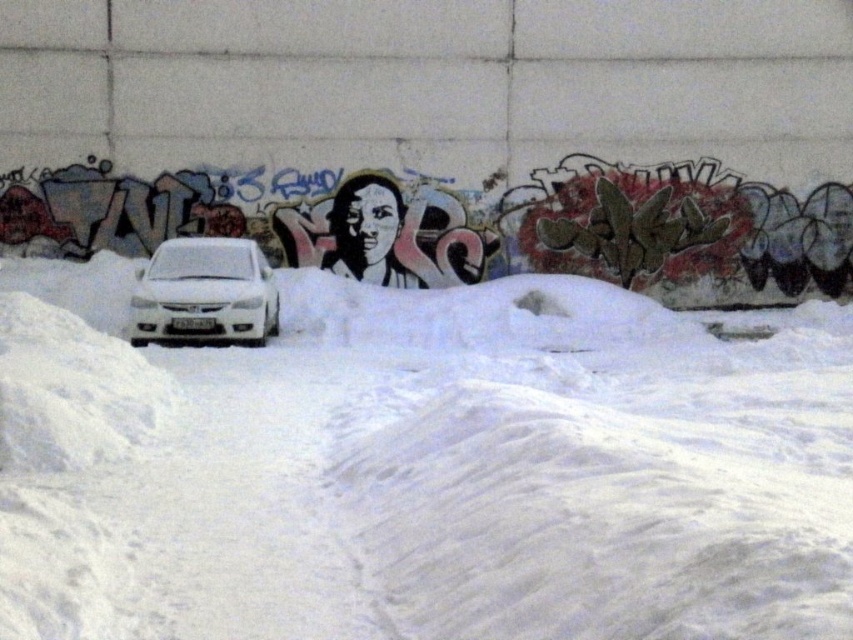
Between white fluffy snow at center and white glossy car at center, which one is positioned higher?

white glossy car at center is above.

Can you confirm if white fluffy snow at center is positioned to the left of white glossy car at center?

In fact, white fluffy snow at center is to the right of white glossy car at center.

Which is behind, point (317, 636) or point (204, 240)?

Positioned behind is point (204, 240).

Image resolution: width=853 pixels, height=640 pixels. What are the coordinates of `white fluffy snow at center` in the screenshot? It's located at [x=421, y=467].